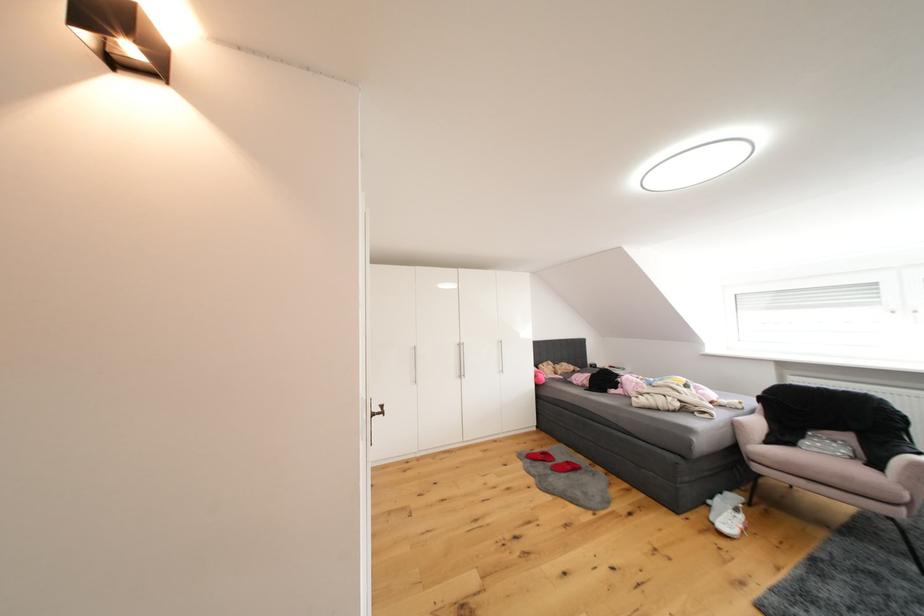
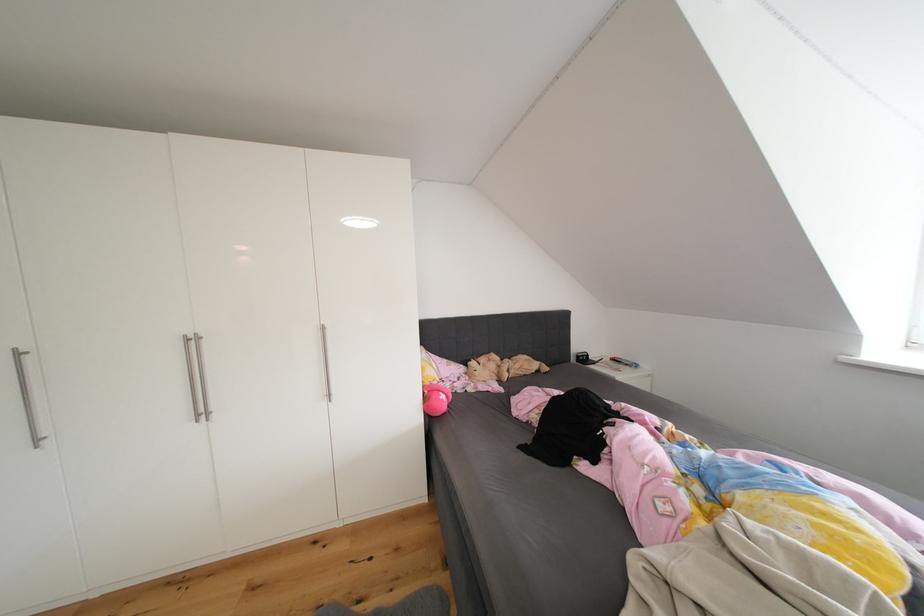
The images are taken continuously from a first-person perspective. In which direction are you moving?

The movement direction of the cameraman is right, forward.